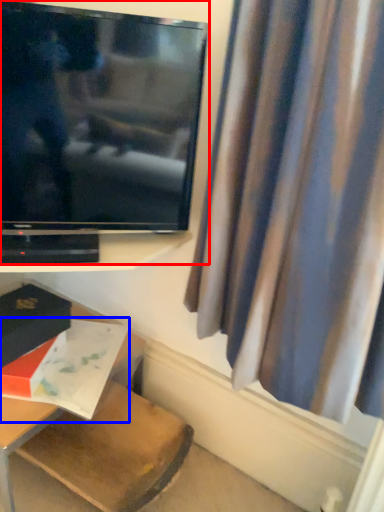
Question: Which of the following is the closest to the observer, television (highlighted by a red box) or book (highlighted by a blue box)?

Choices:
 (A) television
 (B) book

Answer: (A)